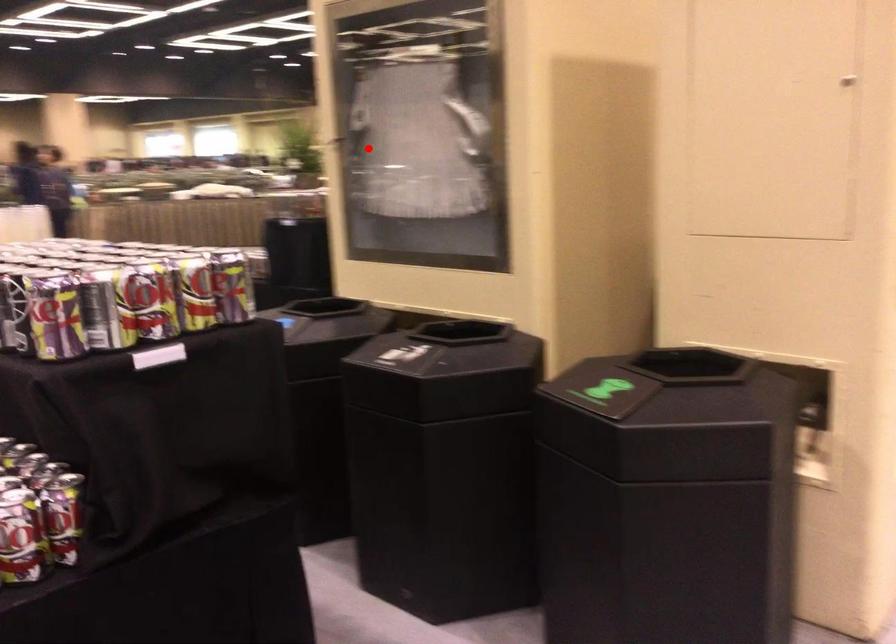
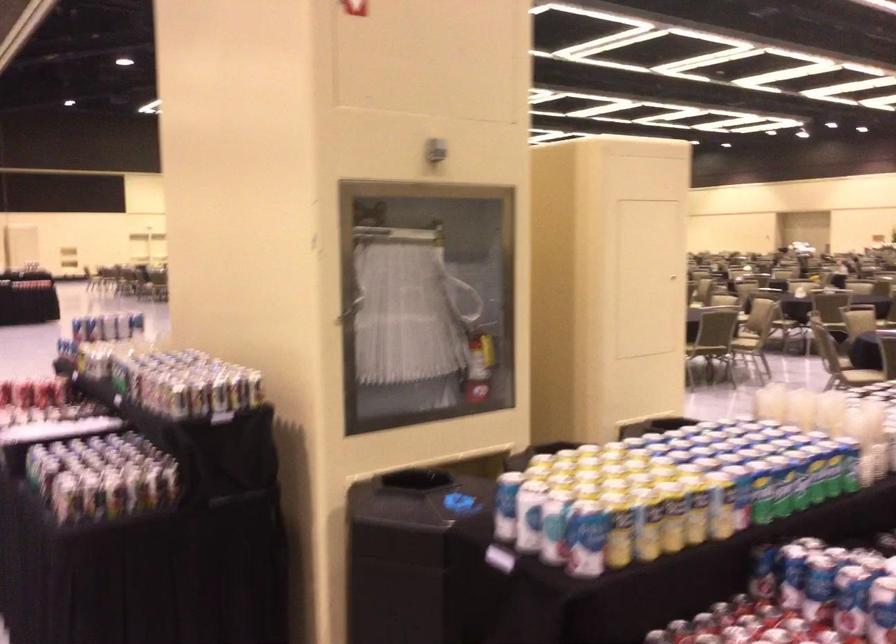
Find the pixel in the second image that matches the highlighted location in the first image.

(349, 310)